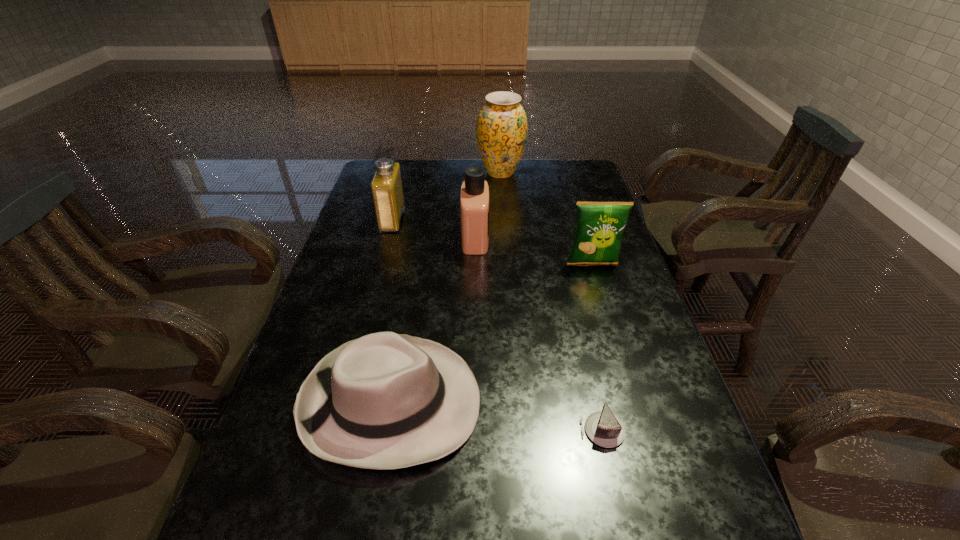
This screenshot has width=960, height=540. In order to click on vacant area situated on the front-facing side of the fourth farthest object in this screenshot , I will do `click(614, 336)`.

Where is `free spot located 0.230m on the front-facing side of the fifth tallest object`? This screenshot has height=540, width=960. free spot located 0.230m on the front-facing side of the fifth tallest object is located at coordinates (590, 402).

Where is `free spot located on the front of the shortest object`? This screenshot has height=540, width=960. free spot located on the front of the shortest object is located at coordinates (620, 509).

At what (x,y) coordinates should I click in order to perform the action: click on object at the far edge. Please return your answer as a coordinate pair (x, y). This screenshot has width=960, height=540. Looking at the image, I should click on (501, 131).

Locate an element on the screen. The height and width of the screenshot is (540, 960). perfume present at the left edge is located at coordinates (386, 186).

This screenshot has width=960, height=540. What are the coordinates of `fedora that is positioned at the left edge` in the screenshot? It's located at click(385, 400).

At what (x,y) coordinates should I click in order to perform the action: click on crisp (potato chip) that is at the right edge. Please return your answer as a coordinate pair (x, y). Looking at the image, I should click on (599, 228).

At what (x,y) coordinates should I click in order to perform the action: click on chocolate cake positioned at the right edge. Please return your answer as a coordinate pair (x, y). Looking at the image, I should click on (603, 428).

Find the location of a particular element. This screenshot has height=540, width=960. vacant region at the far edge is located at coordinates (521, 176).

Locate an element on the screen. free space at the right edge of the desktop is located at coordinates (588, 199).